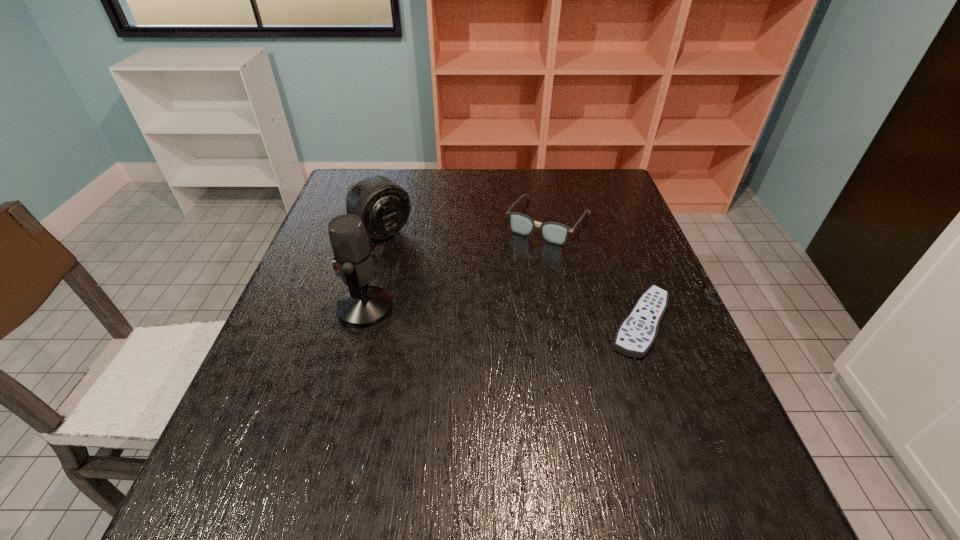
Identify the location of microphone. The width and height of the screenshot is (960, 540). (362, 306).

Image resolution: width=960 pixels, height=540 pixels. In order to click on remote control in this screenshot , I will do `click(636, 334)`.

Identify the location of the second shortest object. (556, 233).

You are a GUI agent. You are given a task and a screenshot of the screen. Output one action in this format:
    pyautogui.click(x=<x>, y=<y>)
    Task: Click on the telephoto lens
    The image size is (960, 540).
    Given the screenshot: What is the action you would take?
    pyautogui.click(x=384, y=207)

The width and height of the screenshot is (960, 540). I want to click on vacant position located 0.100m on the side of the microphone with the red ring, so click(295, 308).

Identify the location of vacant region located 0.070m on the side of the microphone with the red ring. (308, 308).

Find the location of a particular element. This screenshot has height=540, width=960. vacant space located 0.140m on the front of the remote control is located at coordinates (677, 421).

Locate an element on the screen. The height and width of the screenshot is (540, 960). vacant area situated on the face of the second shortest object is located at coordinates (509, 281).

Where is `vacant space located on the face of the second shortest object`? This screenshot has height=540, width=960. vacant space located on the face of the second shortest object is located at coordinates point(500,294).

Find the location of `free spot located on the face of the second shortest object`. free spot located on the face of the second shortest object is located at coordinates (490, 310).